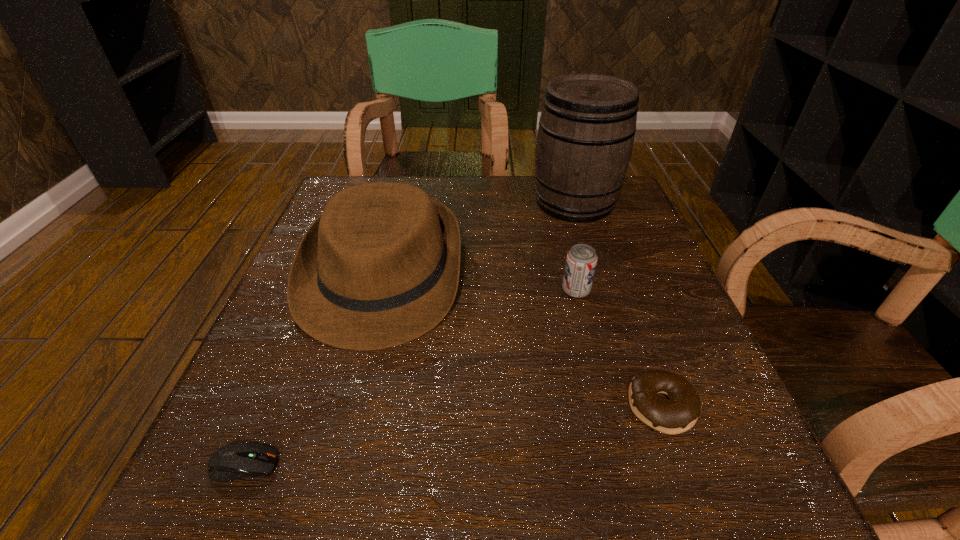
Identify the location of free space between the fedora and the computer equipment. This screenshot has height=540, width=960. (313, 370).

Find the location of a particular element. free spot between the fedora and the tallest object is located at coordinates (479, 239).

Image resolution: width=960 pixels, height=540 pixels. In order to click on free space between the beer can and the nearest object in this screenshot , I will do `click(410, 378)`.

Locate an element on the screen. The width and height of the screenshot is (960, 540). free area in between the fedora and the shortest object is located at coordinates (313, 370).

Find the location of a particular element. free spot between the doughnut and the tallest object is located at coordinates (618, 305).

Where is `vacant area that lies between the nearest object and the fourth shortest object`? The image size is (960, 540). vacant area that lies between the nearest object and the fourth shortest object is located at coordinates (313, 370).

Identify which object is the closest to the nearest object. Please provide its 2D coordinates. Your answer should be formatted as a tuple, i.e. [(x, y)], where the tuple contains the x and y coordinates of a point satisfying the conditions above.

[(380, 267)]

Locate an element on the screen. object that is the third closest one to the fedora is located at coordinates (581, 260).

This screenshot has width=960, height=540. What are the coordinates of `free space that satisfies the following two spatial constraints: 1. on the front-facing side of the fourth shortest object; 2. on the button of the nearest object` in the screenshot? It's located at (334, 465).

Identify the location of vacant position in the image that satisfies the following two spatial constraints: 1. on the front side of the beer can; 2. on the button of the shortest object. (617, 465).